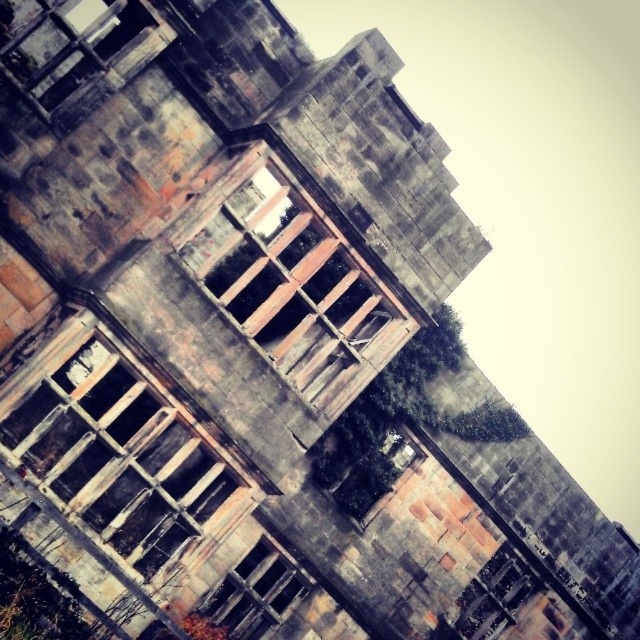
Who is higher up, wooden frame window at lower left or wooden planks at center?

Positioned higher is wooden planks at center.

This screenshot has height=640, width=640. What do you see at coordinates (112, 451) in the screenshot?
I see `wooden frame window at lower left` at bounding box center [112, 451].

Find the location of a particular element. wooden frame window at lower left is located at coordinates (112, 451).

Is wooden frame window at lower left to the left of rusty metal window at center from the viewer's perspective?

Yes, wooden frame window at lower left is to the left of rusty metal window at center.

Can you confirm if wooden frame window at lower left is shorter than rusty metal window at center?

No.

Measure the distance between point (x=83, y=513) and camera.

The distance of point (x=83, y=513) from camera is 84.34 feet.

Locate an element on the screen. The height and width of the screenshot is (640, 640). wooden frame window at lower left is located at coordinates (112, 451).

Where is `wooden planks at center`? This screenshot has width=640, height=640. wooden planks at center is located at coordinates (296, 289).

Consider the image. Does wooden planks at center have a lesser height compared to rusty metal window at center?

No, wooden planks at center is not shorter than rusty metal window at center.

Which is behind, point (296, 276) or point (260, 564)?

The point (260, 564) is more distant.

The height and width of the screenshot is (640, 640). What are the coordinates of `wooden planks at center` in the screenshot? It's located at (296, 289).